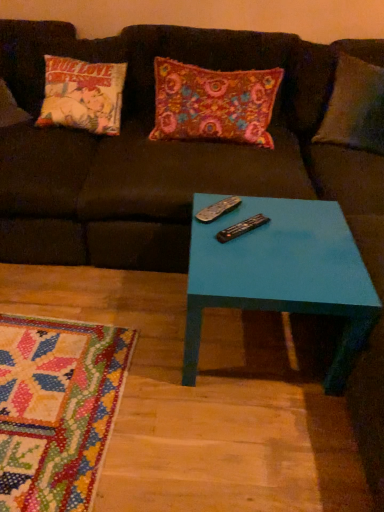
Where is `vacant area that lies in front of teal glossy table at center`? This screenshot has height=512, width=384. vacant area that lies in front of teal glossy table at center is located at coordinates (238, 444).